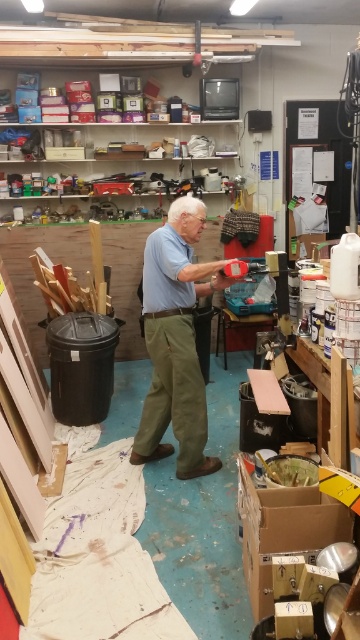
You are standing in the workshop and need to reach the cardboard box at center. There is a light blue cotton shirt at center in your way. Which object should you move first to access the box?

You should move the light blue cotton shirt at center first because it is closer to you and blocking the path to the cardboard box at center, which is behind it.

You are standing in the workshop and see the point marked at coordinates (176,340). What object is located at that point?

The point at coordinates (176,340) indicates the light blue cotton shirt at center.